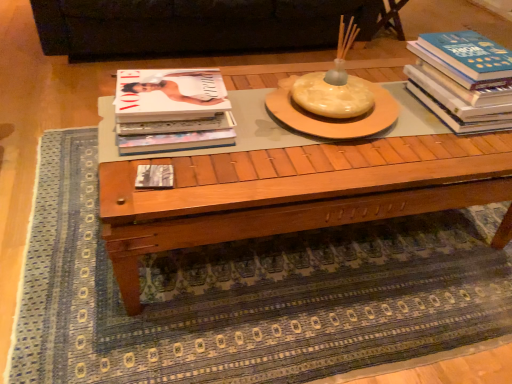
Question: Does matte black book at center, arranged as the first book when viewed from the left, turn towards wooden coffee table at center?

Choices:
 (A) no
 (B) yes

Answer: (B)

Question: Does matte black book at center, marked as the third book in a right-to-left arrangement, appear on the right side of wooden coffee table at center?

Choices:
 (A) yes
 (B) no

Answer: (B)

Question: Is wooden coffee table at center completely or partially inside matte black book at center, marked as the third book in a right-to-left arrangement?

Choices:
 (A) no
 (B) yes

Answer: (A)

Question: Does matte black book at center, arranged as the first book when viewed from the left, have a greater height compared to wooden coffee table at center?

Choices:
 (A) yes
 (B) no

Answer: (B)

Question: Can you confirm if matte black book at center, marked as the third book in a right-to-left arrangement, is smaller than wooden coffee table at center?

Choices:
 (A) yes
 (B) no

Answer: (A)

Question: Is matte black book at center, arranged as the first book when viewed from the left, positioned behind wooden coffee table at center?

Choices:
 (A) no
 (B) yes

Answer: (B)

Question: Is there a large distance between blue hardcover book at right, which appears as the first book when viewed from the right, and wooden coffee table at center?

Choices:
 (A) no
 (B) yes

Answer: (A)

Question: From the image's perspective, is blue hardcover book at right, which appears as the first book when viewed from the right, on wooden coffee table at center?

Choices:
 (A) no
 (B) yes

Answer: (B)

Question: Can you confirm if blue hardcover book at right, which ranks as the third book in left-to-right order, is positioned to the left of wooden coffee table at center?

Choices:
 (A) no
 (B) yes

Answer: (A)

Question: Is blue hardcover book at right, which appears as the first book when viewed from the right, at the right side of wooden coffee table at center?

Choices:
 (A) no
 (B) yes

Answer: (B)

Question: Is blue hardcover book at right, which appears as the first book when viewed from the right, positioned with its back to wooden coffee table at center?

Choices:
 (A) no
 (B) yes

Answer: (A)

Question: Is the position of blue hardcover book at right, which ranks as the third book in left-to-right order, less distant than that of wooden coffee table at center?

Choices:
 (A) no
 (B) yes

Answer: (A)

Question: Is matte white magazine at left, which appears as the 2th book when viewed from the right, aimed at black leather couch at upper center?

Choices:
 (A) yes
 (B) no

Answer: (A)